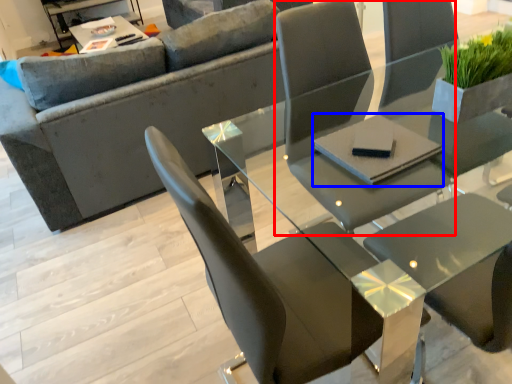
Question: Which point is closer to the camera, chair (highlighted by a red box) or pad (highlighted by a blue box)?

Choices:
 (A) chair
 (B) pad

Answer: (A)